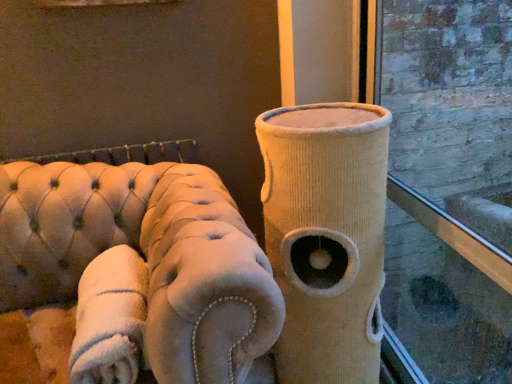
Question: Which is correct: beige tufted sofa at left is inside white plush blanket at lower left, or outside of it?

Choices:
 (A) outside
 (B) inside

Answer: (A)

Question: From a real-world perspective, is beige tufted sofa at left above or below white plush blanket at lower left?

Choices:
 (A) above
 (B) below

Answer: (B)

Question: Based on their relative distances, which object is farther from the beige corduroy cat tower at center?

Choices:
 (A) white plush blanket at lower left
 (B) beige tufted sofa at left

Answer: (A)

Question: Considering the real-world distances, which object is farthest from the white plush blanket at lower left?

Choices:
 (A) beige corduroy cat tower at center
 (B) beige tufted sofa at left

Answer: (A)